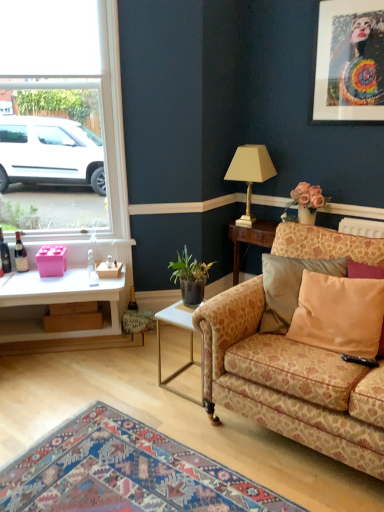
I want to click on vacant space in between clear glass bottle at left, positioned as the first bottle in right-to-left order, and pink matte plastic box at left, which is the first box in top-to-bottom order, so click(x=71, y=276).